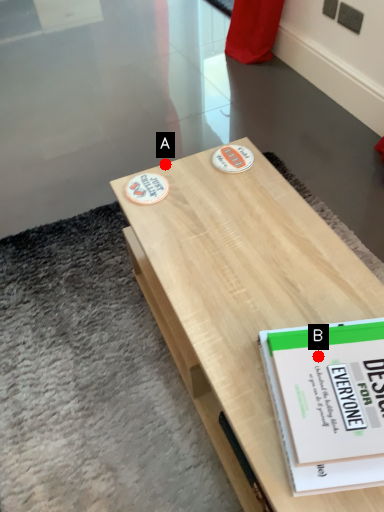
Question: Two points are circled on the image, labeled by A and B beside each circle. Which point is farther to the camera?

Choices:
 (A) A is further
 (B) B is further

Answer: (A)